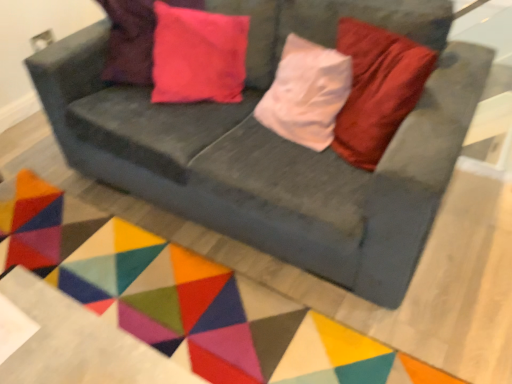
Question: From the image's perspective, is velvet gray couch at center positioned above or below geometric fabric mat at center?

Choices:
 (A) below
 (B) above

Answer: (B)

Question: In the image, is velvet gray couch at center on the left side or the right side of geometric fabric mat at center?

Choices:
 (A) right
 (B) left

Answer: (A)

Question: Which is nearer to the geometric fabric mat at center?

Choices:
 (A) pink velvet pillow at upper left
 (B) velvet gray couch at center

Answer: (B)

Question: Estimate the real-world distances between objects in this image. Which object is farther from the geometric fabric mat at center?

Choices:
 (A) velvet gray couch at center
 (B) pink velvet pillow at upper left

Answer: (B)